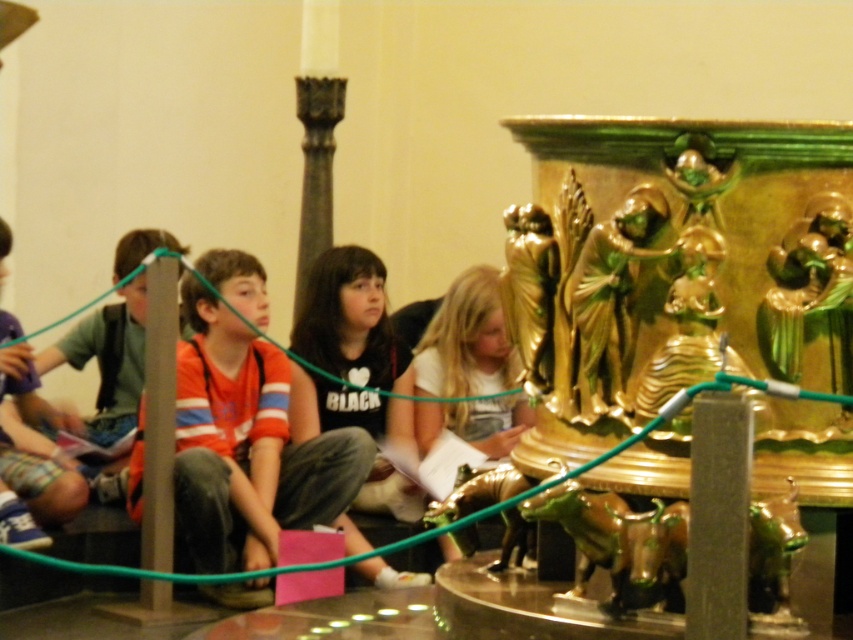
Question: Which point is closer to the camera?

Choices:
 (A) (111, 449)
 (B) (381, 376)
 (C) (233, 440)

Answer: (C)

Question: Is orange t-shirt at center positioned at the back of matte green backpack at left?

Choices:
 (A) yes
 (B) no

Answer: (B)

Question: Is orange t-shirt at center above black matte shirt at center?

Choices:
 (A) yes
 (B) no

Answer: (B)

Question: Is black matte shirt at center thinner than matte green backpack at left?

Choices:
 (A) yes
 (B) no

Answer: (B)

Question: Which point is farther from the camera taking this photo?

Choices:
 (A) (418, 449)
 (B) (202, 317)
 (C) (311, 314)

Answer: (C)

Question: Which object appears farthest from the camera in this image?

Choices:
 (A) orange t-shirt at center
 (B) matte green backpack at left
 (C) black matte shirt at center
 (D) white matte shirt at center

Answer: (B)